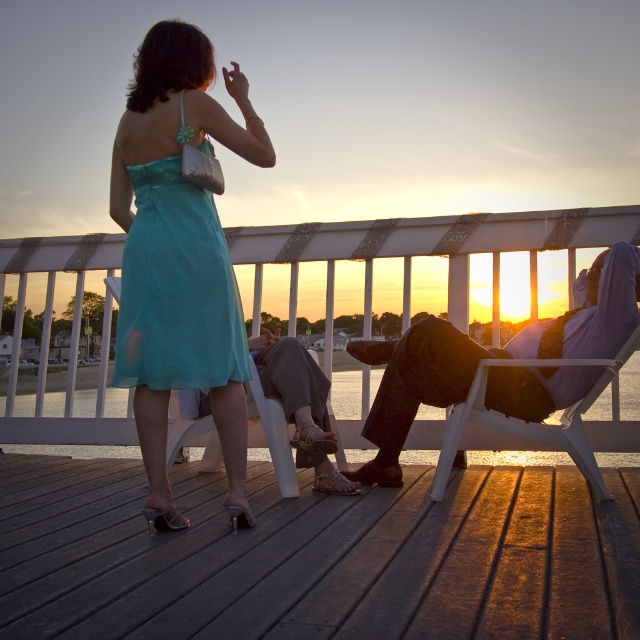
You are standing on the wooden deck and want to hand a small gift to the person wearing the teal chiffon dress at center without moving closer. You have a 2.5 meter long ribbon. Can you reach them using the ribbon?

The teal chiffon dress at center and viewer are 2.48 meters apart from each other. Since the ribbon is 2.5 meters long, it is slightly longer than the distance needed, so you can successfully reach the person wearing the teal chiffon dress at center using the ribbon.

You are standing on the wooden deck and want to take a photo of the teal chiffon dress at center and the matte black pants at right. Which object should you focus on first if you want to capture both in the same frame without moving the camera?

The teal chiffon dress at center is above the matte black pants at right, so you should focus on the teal chiffon dress at center first to ensure both are in the frame.